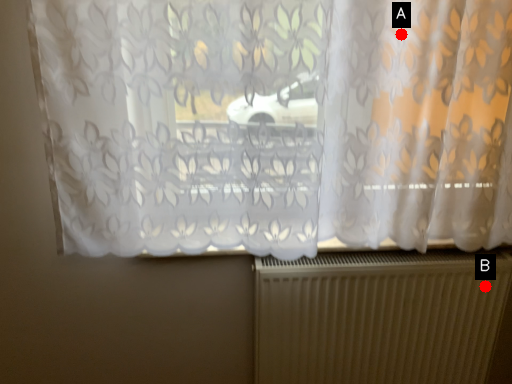
Question: Two points are circled on the image, labeled by A and B beside each circle. Which point is farther to the camera?

Choices:
 (A) A is further
 (B) B is further

Answer: (B)